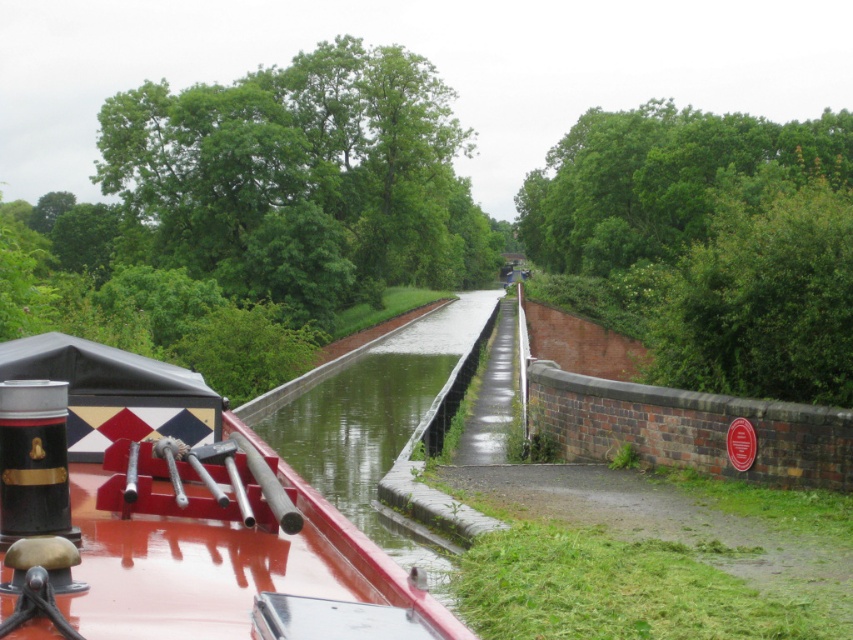
You are a tourist standing on the path next to the canal. You want to take a photo of the shiny red boat at center and the green leafy tree at upper left in the same frame. Given that your camera can capture a maximum distance of 60 meters between the nearest and farthest objects, will you be able to include both in one photo?

The distance between the green leafy tree at upper left and the shiny red boat at center is 68.65 meters, which exceeds the camera maximum of 60 meters. Therefore, you cannot capture both in one photo.

You are a tour guide explaining the canal layout to visitors. Pointing to the shiny red boat at center and the green concrete canal at center, you want to clarify their positions. Which object is located to the left of the other?

The shiny red boat at center is positioned on the left side of green concrete canal at center.